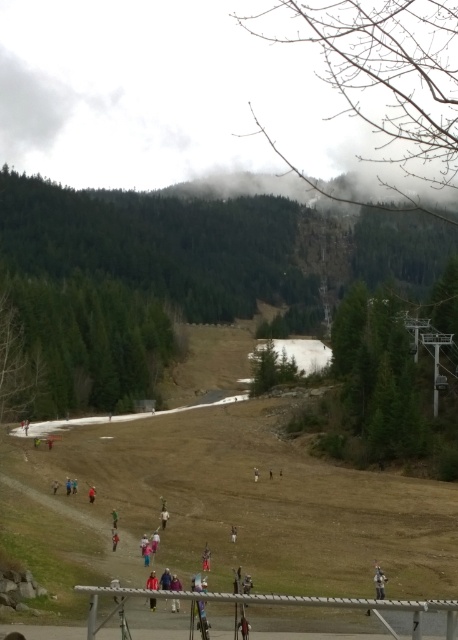
From the picture: You are a photographer standing at the ski resort and want to capture a photo of both the red jacket at lower center and the blue fabric jacket at lower center. Which jacket should you adjust your camera focus to first if you want to include both in the frame?

The red jacket at lower center is positioned on the right side of blue fabric jacket at lower center. Since they are both at the same lower center position, you can focus on either one first as they are adjacent to each other.